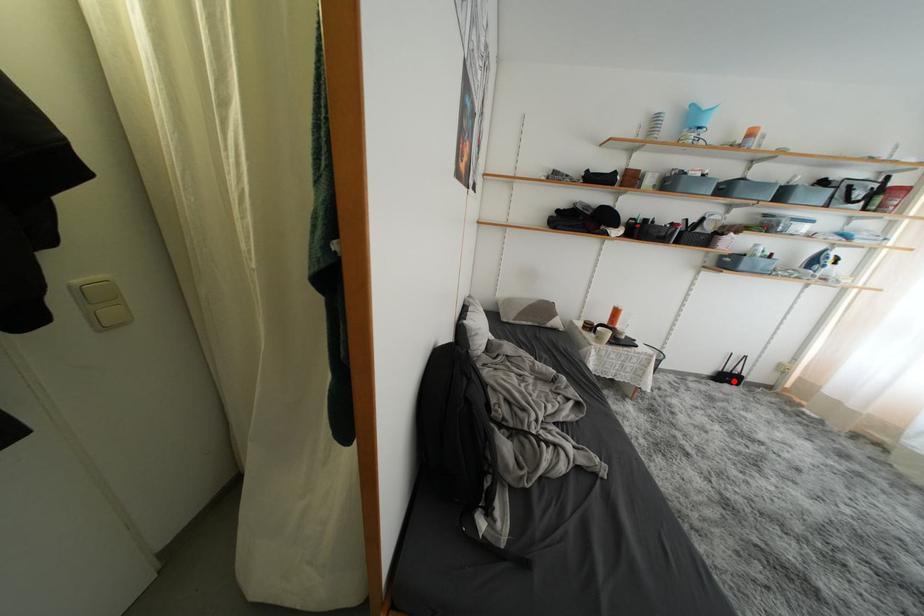
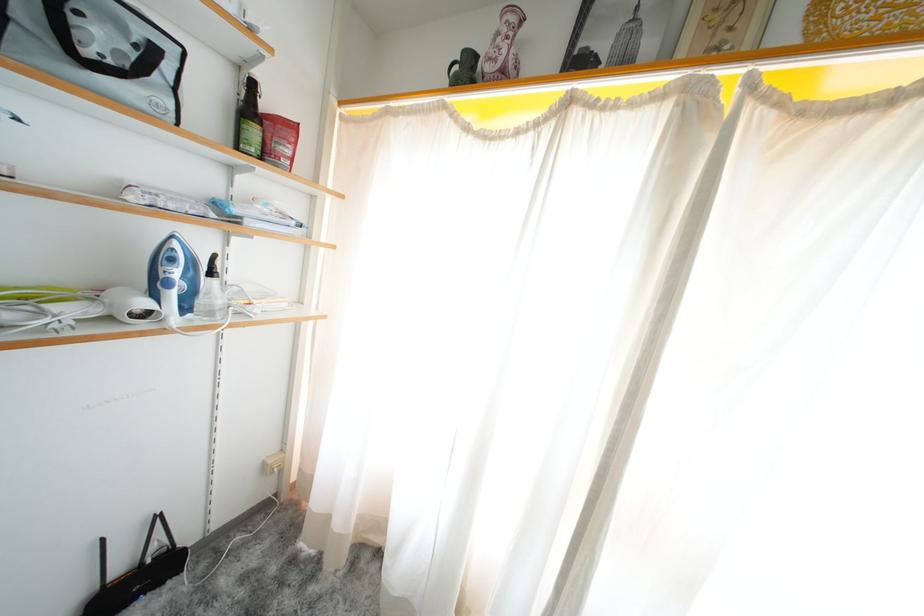
The point at the highlighted location is marked in the first image. Where is the corresponding point in the second image?

(143, 586)